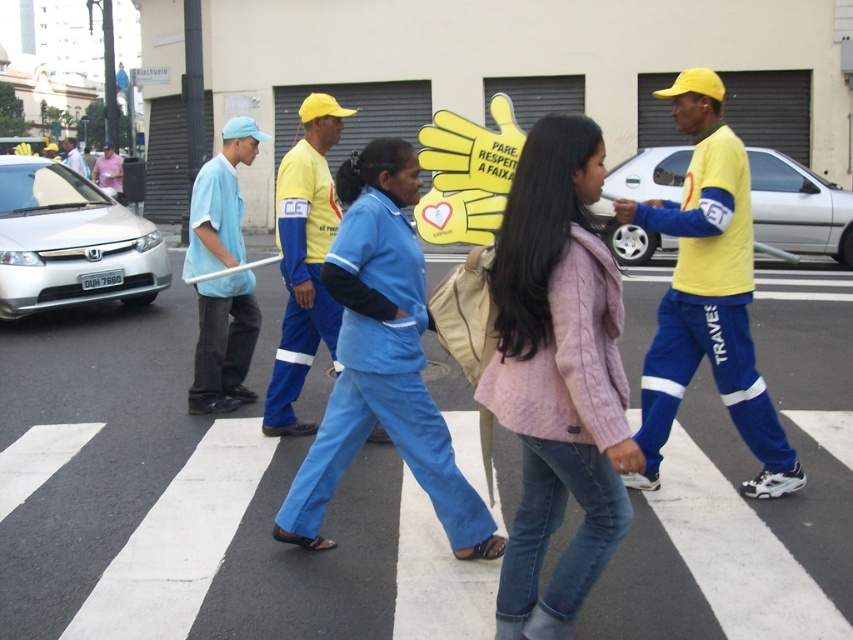
Which is below, blue uniform at center or light blue fabric shirt at center?

blue uniform at center is below.

Does blue uniform at center appear over light blue fabric shirt at center?

No, blue uniform at center is not above light blue fabric shirt at center.

Locate an element on the screen. The height and width of the screenshot is (640, 853). blue uniform at center is located at coordinates [x=305, y=260].

Where is `blue uniform at center`? blue uniform at center is located at coordinates (305, 260).

Is blue fabric uniform at center below light blue fabric shirt at center?

Indeed, blue fabric uniform at center is positioned under light blue fabric shirt at center.

In the scene shown: Does blue fabric uniform at center have a greater height compared to light blue fabric shirt at center?

In fact, blue fabric uniform at center may be shorter than light blue fabric shirt at center.

Is point (407, 449) more distant than point (83, 172)?

No, (407, 449) is in front of (83, 172).

Where is `blue fabric uniform at center`? This screenshot has height=640, width=853. blue fabric uniform at center is located at coordinates (381, 358).

Does yellow matte shirt at center appear on the left side of blue uniform at center?

Incorrect, yellow matte shirt at center is not on the left side of blue uniform at center.

Which is in front, point (740, 362) or point (291, 273)?

Point (740, 362)

Does point (735, 145) come in front of point (294, 184)?

Yes.

Locate an element on the screen. The width and height of the screenshot is (853, 640). yellow matte shirt at center is located at coordinates tap(706, 294).